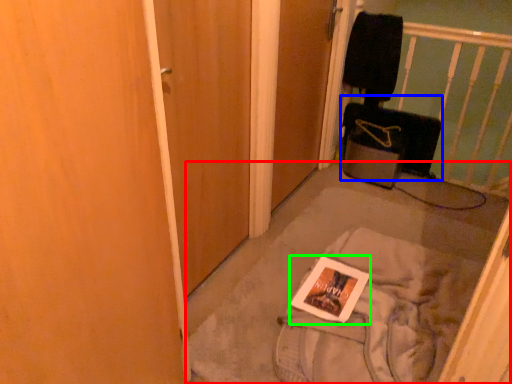
Question: Which object is the closest to the concrete (highlighted by a red box)? Choose among these: luggage (highlighted by a blue box) or magazine (highlighted by a green box).

Choices:
 (A) luggage
 (B) magazine

Answer: (B)